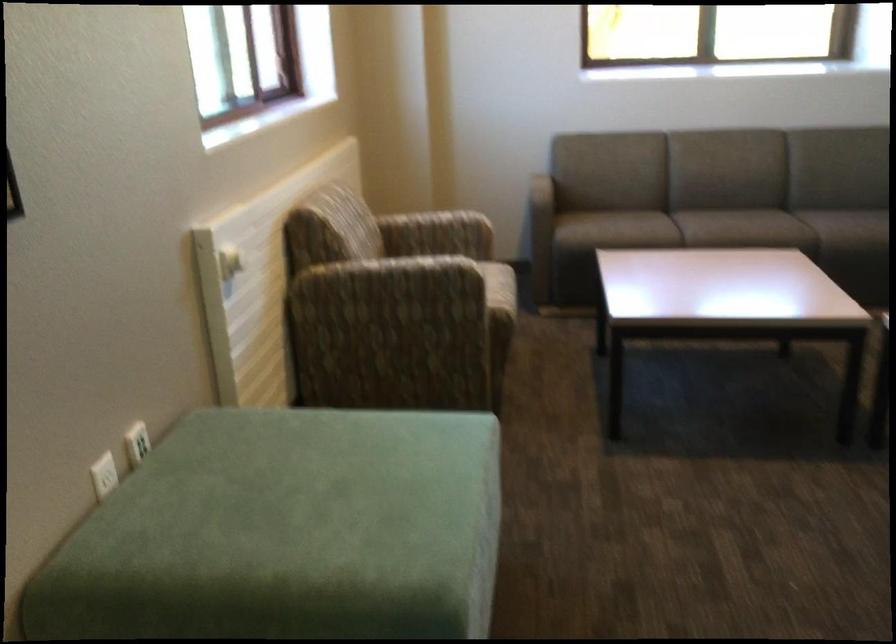
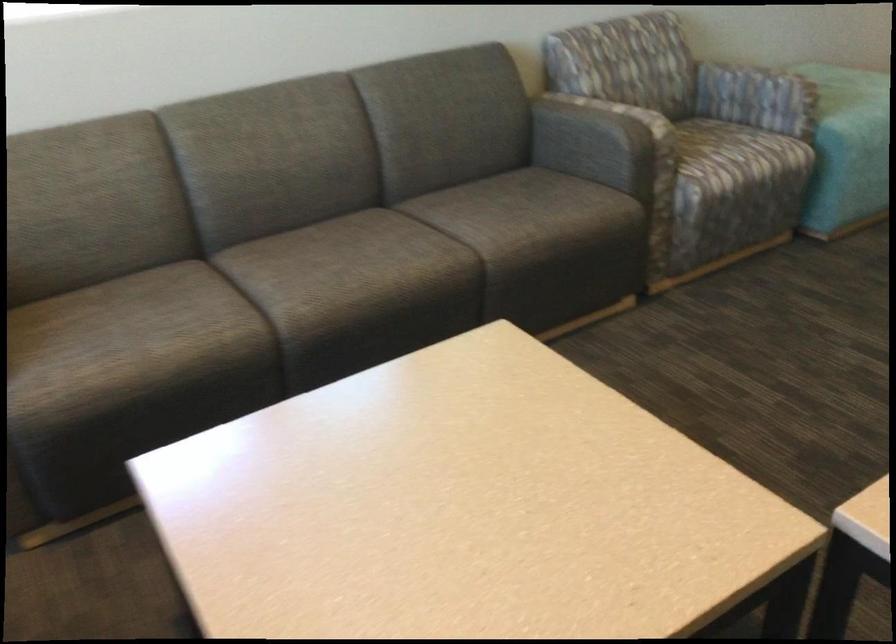
Find the pixel in the second image that matches (772,232) in the first image.

(427, 269)